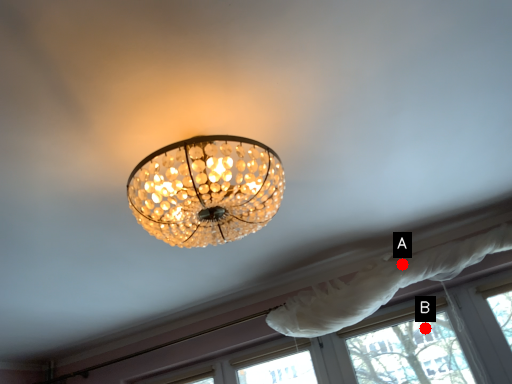
Question: Two points are circled on the image, labeled by A and B beside each circle. Which point is closer to the camera?

Choices:
 (A) A is closer
 (B) B is closer

Answer: (A)